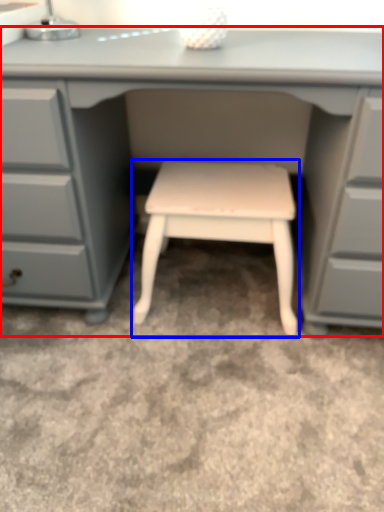
Question: Among these objects, which one is farthest to the camera, desk (highlighted by a red box) or stool (highlighted by a blue box)?

Choices:
 (A) desk
 (B) stool

Answer: (B)